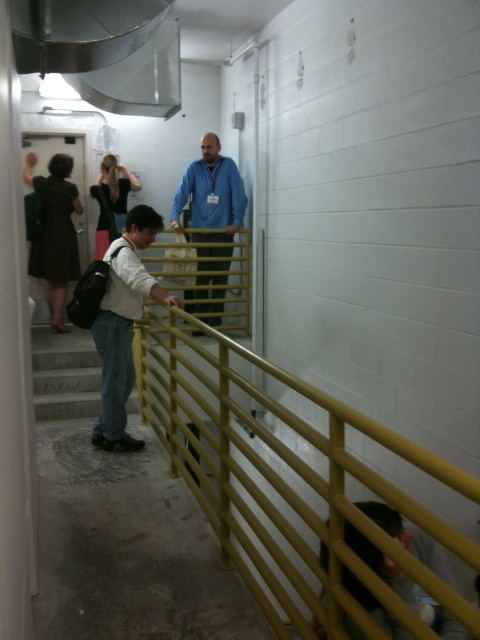
Who is positioned more to the left, yellow matte rail at center or brown fabric dress at upper left?

From the viewer's perspective, brown fabric dress at upper left appears more on the left side.

Between yellow matte rail at center and brown fabric dress at upper left, which one is positioned higher?

brown fabric dress at upper left is above.

Find the location of a particular element. yellow matte rail at center is located at coordinates (275, 468).

Where is `yellow matte rail at center`? The width and height of the screenshot is (480, 640). yellow matte rail at center is located at coordinates (275, 468).

Does yellow matte rail at center have a lesser width compared to blue fabric shirt at center?

No.

Does point (395, 502) lie in front of point (227, 156)?

That is True.

Who is more forward, [288,561] or [216,179]?

Positioned in front is point [288,561].

At what (x,y) coordinates should I click in order to perform the action: click on yellow matte rail at center. Please return your answer as a coordinate pair (x, y). Looking at the image, I should click on (275, 468).

Does blue fabric shirt at center have a larger size compared to brown fabric dress at upper left?

Yes.

Is point (193, 192) closer to camera compared to point (54, 301)?

Yes, point (193, 192) is closer to viewer.

At what (x,y) coordinates should I click in order to perform the action: click on blue fabric shirt at center. Please return your answer as a coordinate pair (x, y). This screenshot has width=480, height=640. Looking at the image, I should click on (211, 195).

Where is `blue fabric shirt at center`? The height and width of the screenshot is (640, 480). blue fabric shirt at center is located at coordinates (211, 195).